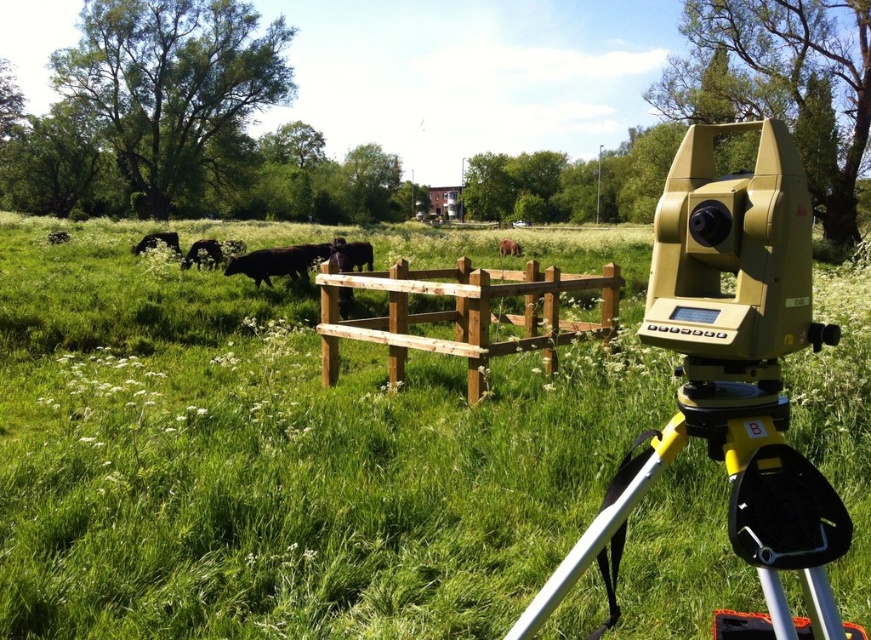
Does black smooth cow at center have a smaller size compared to black matte cow at upper left?

No, black smooth cow at center is not smaller than black matte cow at upper left.

Which of these two, black smooth cow at center or black matte cow at upper left, stands shorter?

Standing shorter between the two is black matte cow at upper left.

Who is more distant from viewer, (292, 276) or (150, 244)?

The point (150, 244) is behind.

I want to click on black smooth cow at center, so click(277, 262).

This screenshot has width=871, height=640. Identify the location of yellow plastic tripod at lower right. (728, 500).

Is yellow plastic tripod at lower right positioned in front of black matte cow at center-left?

That is True.

Who is more distant from viewer, (x=733, y=419) or (x=191, y=256)?

Point (x=191, y=256)

At what (x,y) coordinates should I click in order to perform the action: click on yellow plastic tripod at lower right. Please return your answer as a coordinate pair (x, y). This screenshot has height=640, width=871. Looking at the image, I should click on (728, 500).

Can you confirm if yellow plastic tripod at lower right is positioned below black glossy cow at center?

Yes, yellow plastic tripod at lower right is below black glossy cow at center.

Between yellow plastic tripod at lower right and black glossy cow at center, which one has more height?

yellow plastic tripod at lower right is taller.

Is point (805, 586) positioned in front of point (356, 262)?

Yes, it is in front of point (356, 262).

The image size is (871, 640). I want to click on yellow plastic tripod at lower right, so click(728, 500).